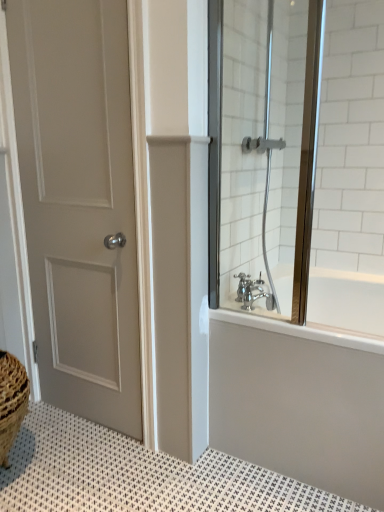
At what (x,y) coordinates should I click in order to perform the action: click on free space in front of silver metallic faucet at lower right. Please return your answer as a coordinate pair (x, y). This screenshot has width=384, height=512. Looking at the image, I should click on (267, 320).